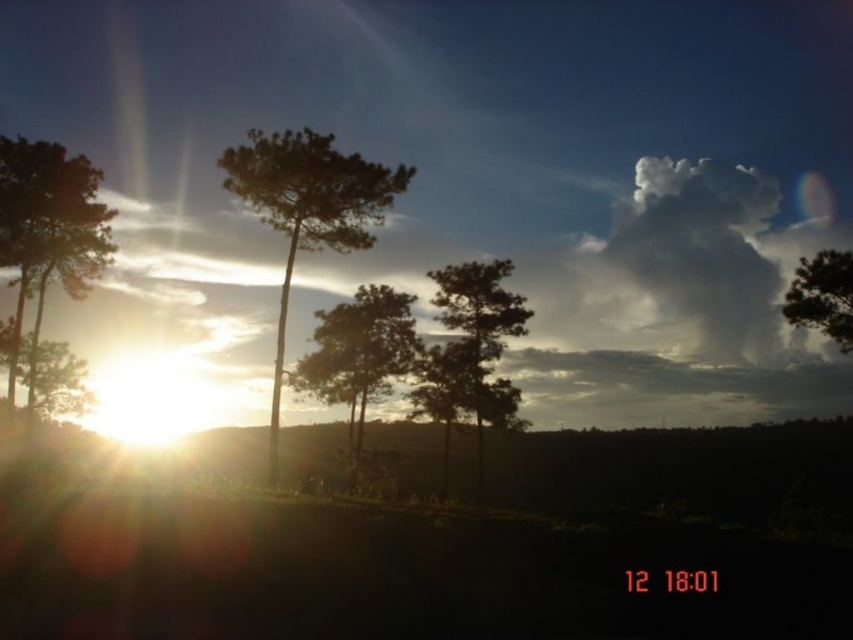
Is silhouette wood tree at left further to the viewer compared to green matte tree at upper right?

Yes.

Is point (9, 166) positioned before point (788, 312)?

No, it is not.

Who is more forward, (68, 282) or (840, 276)?

Point (840, 276) is more forward.

This screenshot has height=640, width=853. What are the coordinates of `silhouette wood tree at left` in the screenshot? It's located at (49, 225).

How distant is silhouette wood tree at center from green matte tree at center?

10.08 meters

Between silhouette wood tree at center and green matte tree at center, which one appears on the left side from the viewer's perspective?

green matte tree at center is more to the left.

Which is behind, point (462, 323) or point (343, 305)?

The point (462, 323) is more distant.

Where is `silhouette wood tree at center`? This screenshot has width=853, height=640. silhouette wood tree at center is located at coordinates (474, 344).

Is point (332, 330) positioned after point (830, 266)?

Yes, point (332, 330) is behind point (830, 266).

Where is `green matte tree at center`? The width and height of the screenshot is (853, 640). green matte tree at center is located at coordinates (358, 353).

Identify the location of green matte tree at center. The height and width of the screenshot is (640, 853). (358, 353).